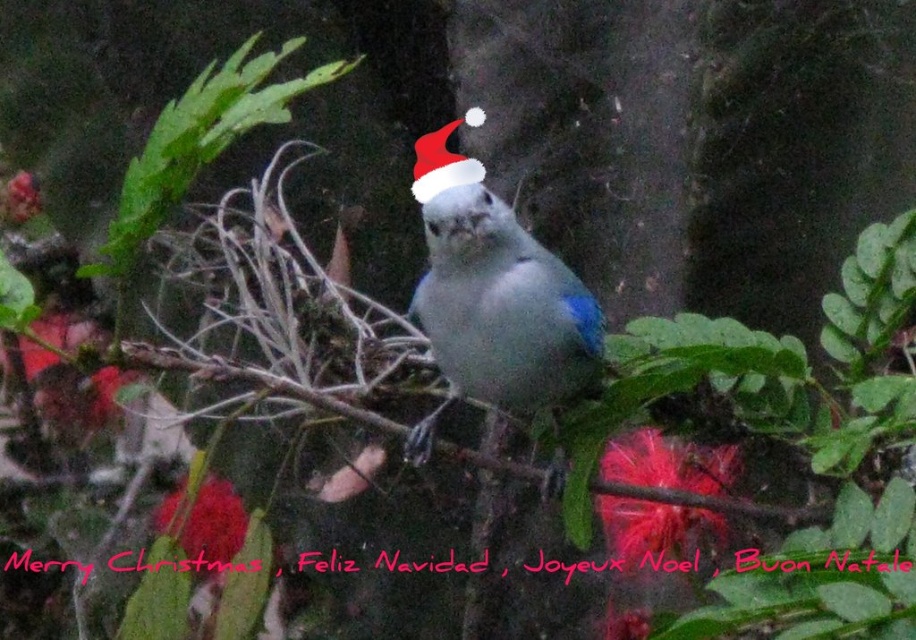
Image resolution: width=916 pixels, height=640 pixels. What do you see at coordinates (499, 312) in the screenshot? I see `matte white bird at center` at bounding box center [499, 312].

Is point (553, 371) closer to camera compared to point (455, 172)?

No.

In order to click on matte white bird at center in this screenshot , I will do `click(499, 312)`.